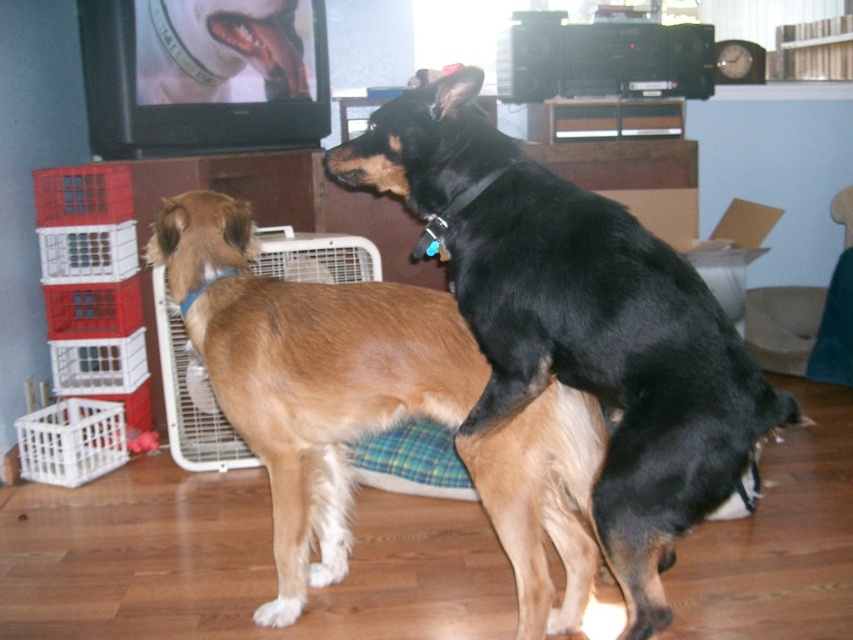
Is the position of black smooth dog at center more distant than that of brown furry dog at center?

No.

Is black smooth dog at center thinner than brown furry dog at center?

Yes, black smooth dog at center is thinner than brown furry dog at center.

Is point (521, 356) in front of point (496, 508)?

Yes, point (521, 356) is in front of point (496, 508).

At what (x,y) coordinates should I click in order to perform the action: click on black smooth dog at center. Please return your answer as a coordinate pair (x, y). Image resolution: width=853 pixels, height=640 pixels. Looking at the image, I should click on (577, 323).